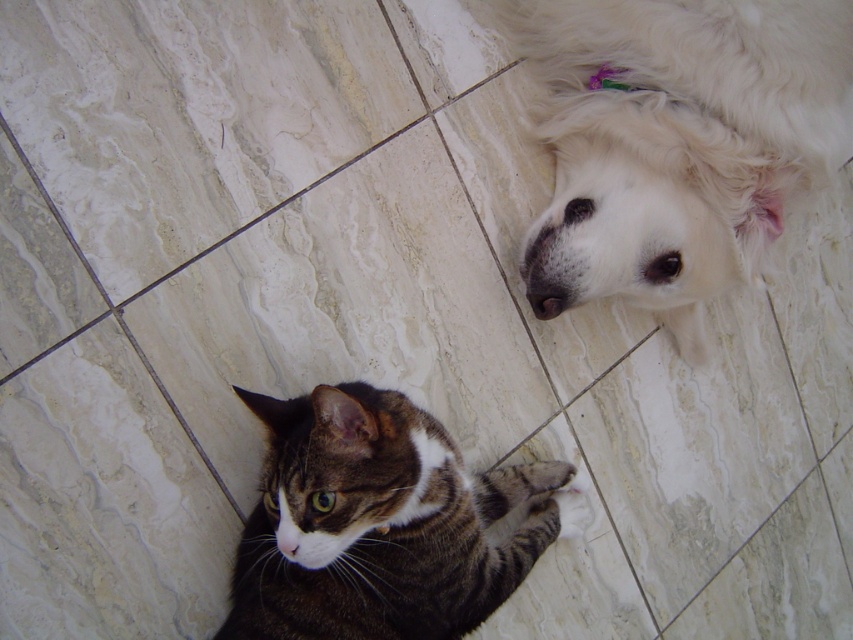
Question: Does white fluffy dog at upper right come in front of tabby fur cat at lower left?

Choices:
 (A) yes
 (B) no

Answer: (B)

Question: Which object is closer to the camera taking this photo?

Choices:
 (A) white fluffy dog at upper right
 (B) tabby fur cat at lower left

Answer: (B)

Question: From the image, what is the correct spatial relationship of white fluffy dog at upper right in relation to tabby fur cat at lower left?

Choices:
 (A) left
 (B) right

Answer: (B)

Question: Is white fluffy dog at upper right to the right of tabby fur cat at lower left from the viewer's perspective?

Choices:
 (A) no
 (B) yes

Answer: (B)